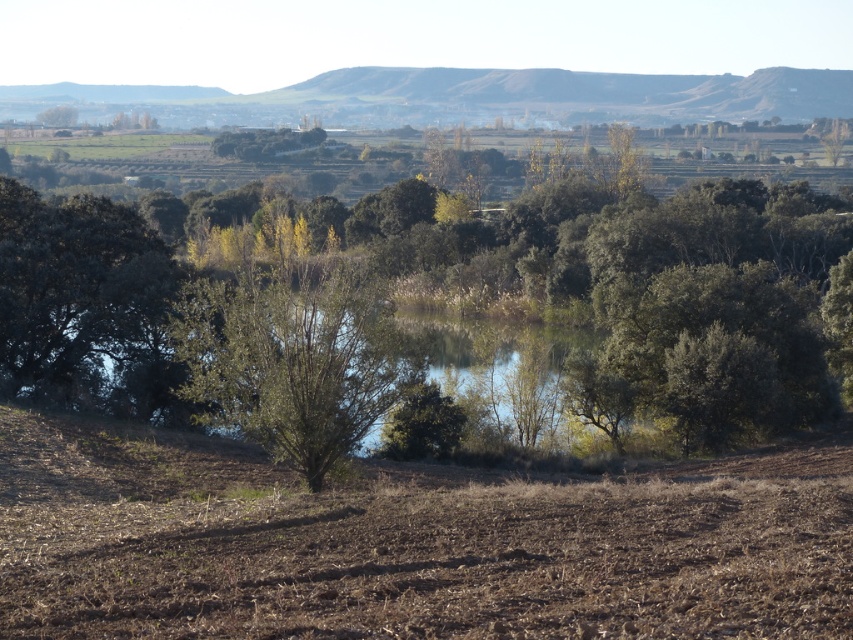
Does green leafy tree at center have a greater height compared to green matte tree at left?

Yes, green leafy tree at center is taller than green matte tree at left.

Describe the element at coordinates (434, 307) in the screenshot. The width and height of the screenshot is (853, 640). I see `green leafy tree at center` at that location.

Is point (642, 316) in front of point (135, 280)?

No, (642, 316) is behind (135, 280).

Identify the location of green leafy tree at center. (434, 307).

Can you confirm if brown soil at lower center is positioned above green leafy tree at upper left?

Actually, brown soil at lower center is below green leafy tree at upper left.

Is brown soil at lower center shorter than green leafy tree at upper left?

Indeed, brown soil at lower center has a lesser height compared to green leafy tree at upper left.

The width and height of the screenshot is (853, 640). What do you see at coordinates (407, 545) in the screenshot?
I see `brown soil at lower center` at bounding box center [407, 545].

This screenshot has height=640, width=853. Find the location of `brown soil at lower center`. brown soil at lower center is located at coordinates (407, 545).

Between point (94, 257) and point (62, 124), which one is positioned behind?

Positioned behind is point (62, 124).

The image size is (853, 640). Describe the element at coordinates (82, 304) in the screenshot. I see `green matte tree at left` at that location.

Describe the element at coordinates (82, 304) in the screenshot. I see `green matte tree at left` at that location.

You are a GUI agent. You are given a task and a screenshot of the screen. Output one action in this format:
    pyautogui.click(x=<x>, y=<y>)
    Task: Click on the green matte tree at left
    
    Given the screenshot: What is the action you would take?
    pyautogui.click(x=82, y=304)